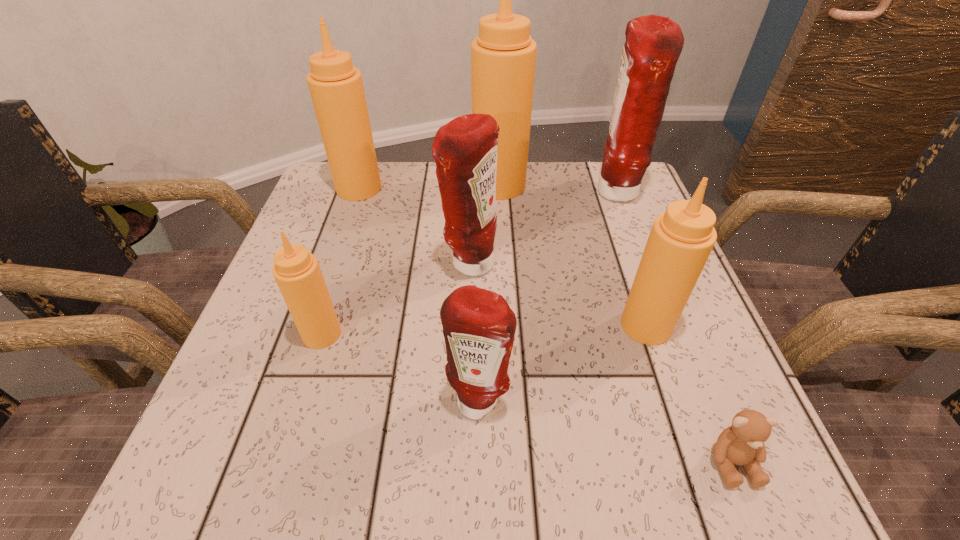
At what (x,y) coordinates should I click in order to perform the action: click on free space between the nearest red condiment and the smallest tan condiment. Please return your answer as a coordinate pair (x, y). Looking at the image, I should click on (400, 366).

What are the coordinates of `free space between the brown teddy bear and the third smallest tan condiment` in the screenshot? It's located at (x=545, y=325).

This screenshot has width=960, height=540. I want to click on free space between the rightmost red condiment and the biggest tan condiment, so pos(557,188).

You are a GUI agent. You are given a task and a screenshot of the screen. Output one action in this format:
    pyautogui.click(x=<x>, y=<y>)
    Task: Click on the vacant area that lies between the third smallest tan condiment and the smallest red condiment
    
    Given the screenshot: What is the action you would take?
    pyautogui.click(x=419, y=293)

The width and height of the screenshot is (960, 540). In order to click on vacant space in between the second nearest object and the smallest tan condiment in this screenshot , I will do `click(400, 366)`.

You are a GUI agent. You are given a task and a screenshot of the screen. Output one action in this format:
    pyautogui.click(x=<x>, y=<y>)
    Task: Click on the vacant area that lies between the second tan condiment from right to left and the farthest red condiment
    The width and height of the screenshot is (960, 540).
    Given the screenshot: What is the action you would take?
    pyautogui.click(x=557, y=188)

Find the location of a particular element. The width and height of the screenshot is (960, 540). empty space that is in between the brown teddy bear and the third smallest tan condiment is located at coordinates (545, 325).

Image resolution: width=960 pixels, height=540 pixels. Identify the location of free space between the rightmost tan condiment and the fourth farthest condiment. (558, 294).

Identify the location of object that is the second closest to the shortest object. The image size is (960, 540). (479, 327).

Locate which object ranks seventh in proximity to the third smallest tan condiment. Please provide its 2D coordinates. Your answer should be formatted as a tuple, i.e. [(x, y)], where the tuple contains the x and y coordinates of a point satisfying the conditions above.

[(742, 443)]